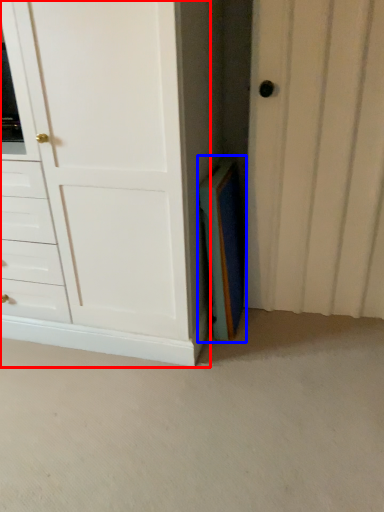
Question: Which object appears closest to the camera in this image, chest of drawers (highlighted by a red box) or paperback book (highlighted by a blue box)?

Choices:
 (A) chest of drawers
 (B) paperback book

Answer: (A)